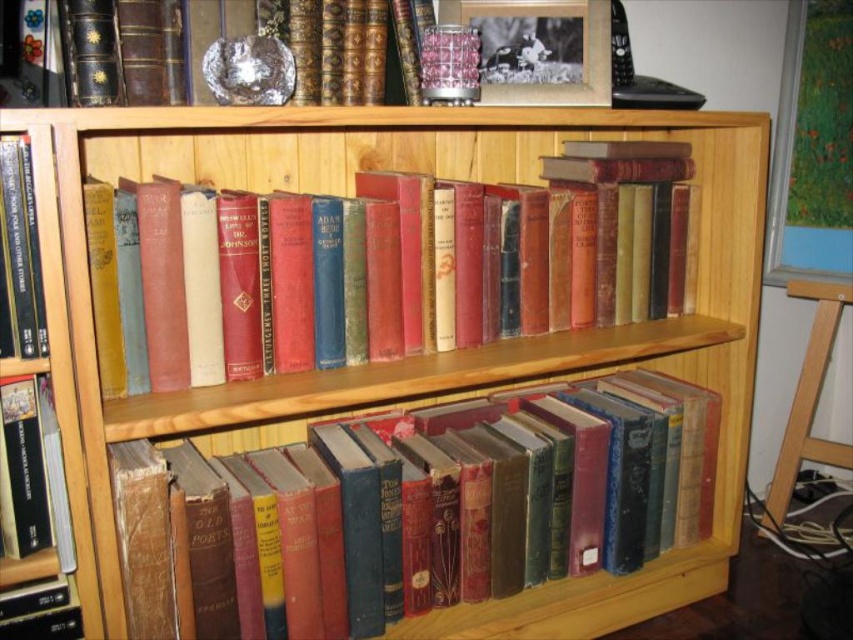
You are standing in front of the wooden bookshelf and want to place a new book exactly where the matte black book at left is currently located. What are the coordinates of the spot where you should place the new book?

The coordinates for the matte black book at left are at point (21, 248), so you should place the new book there.